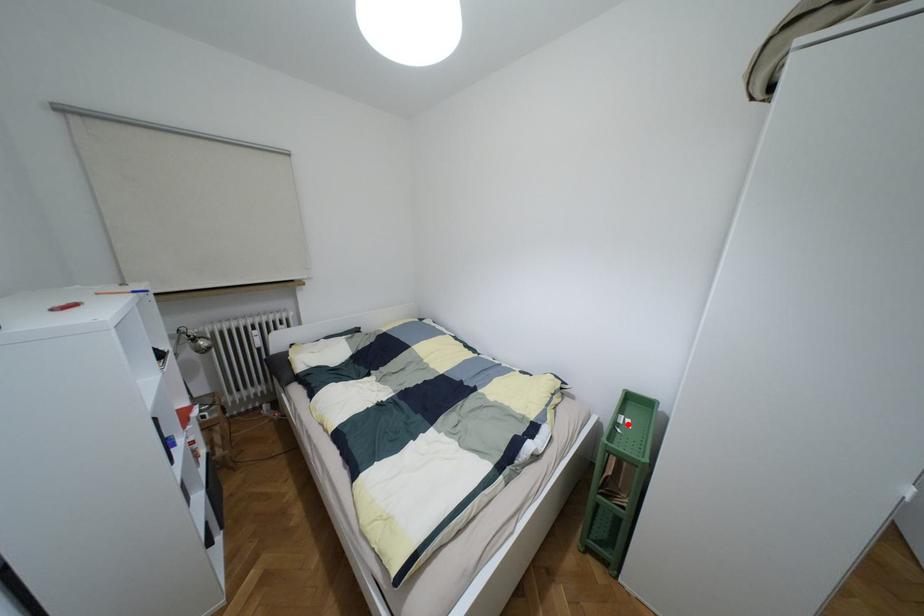
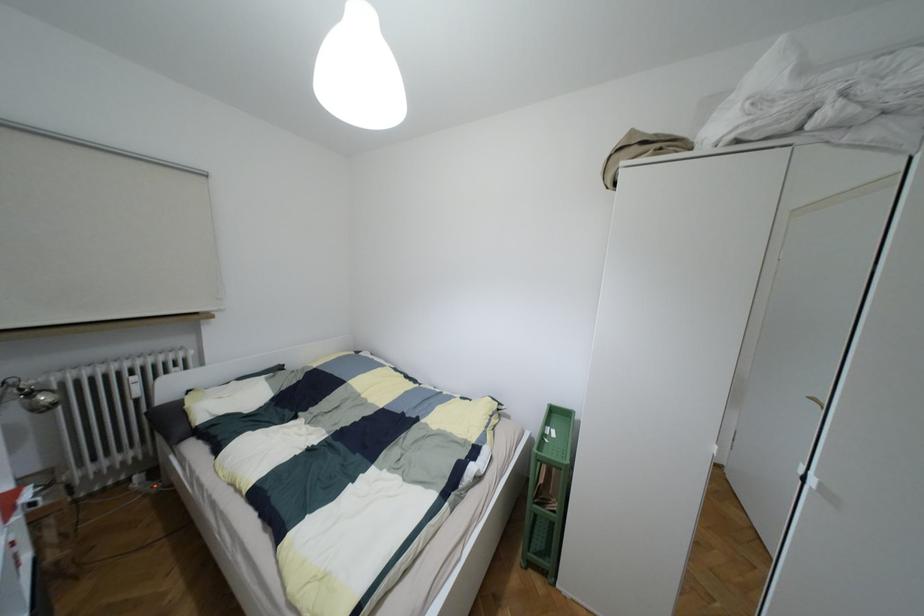
Where in the second image is the point corresponding to the highlighted location from the first image?

(553, 434)